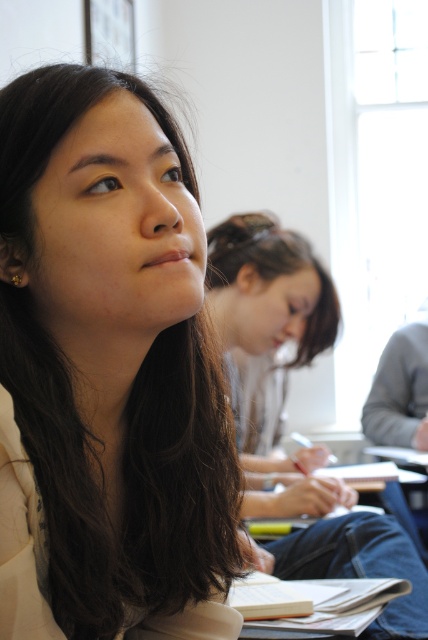
Is matte beige shirt at upper left shorter than smooth brown hair at center?

Correct, matte beige shirt at upper left is not as tall as smooth brown hair at center.

Find the location of a particular element. matte beige shirt at upper left is located at coordinates (107, 372).

What are the coordinates of `matte beige shirt at upper left` in the screenshot? It's located at (107, 372).